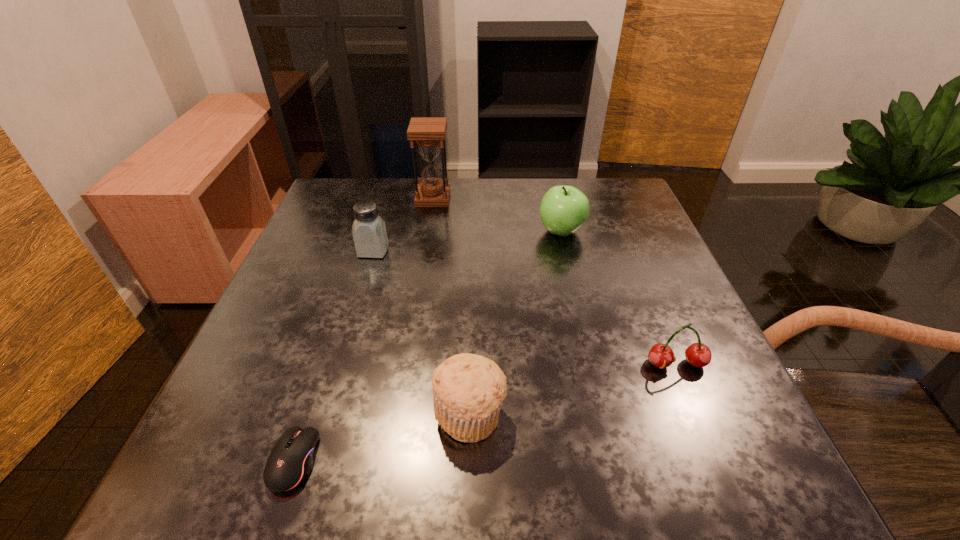
You are a GUI agent. You are given a task and a screenshot of the screen. Output one action in this format:
    pyautogui.click(x=<x>, y=<y>)
    Task: Click on the hourglass
    This screenshot has width=960, height=540.
    Given the screenshot: What is the action you would take?
    pyautogui.click(x=428, y=132)

Find the location of `the tallest object`. the tallest object is located at coordinates (428, 132).

You are a GUI agent. You are given a task and a screenshot of the screen. Output one action in this format:
    pyautogui.click(x=<x>, y=<y>)
    Task: Click on the apple
    The image size is (960, 540).
    Given the screenshot: What is the action you would take?
    point(564,209)

I want to click on saltshaker, so click(369, 232).

This screenshot has height=540, width=960. I want to click on muffin, so click(468, 390).

You are a GUI agent. You are given a task and a screenshot of the screen. Output one action in this format:
    pyautogui.click(x=<x>, y=<y>)
    Task: Click on the rightmost object
    
    Given the screenshot: What is the action you would take?
    pyautogui.click(x=661, y=355)

The width and height of the screenshot is (960, 540). What are the coordinates of `the fourth farthest object` in the screenshot? It's located at (661, 355).

I want to click on computer mouse, so [290, 462].

Find the location of `vacant space located 0.310m on the right of the fourth object from right to left`. vacant space located 0.310m on the right of the fourth object from right to left is located at coordinates (568, 199).

At what (x,y) coordinates should I click in order to perform the action: click on vacant space situated on the right of the fifth object from left to right. Please return your answer as a coordinate pair (x, y). This screenshot has height=540, width=960. Looking at the image, I should click on (636, 231).